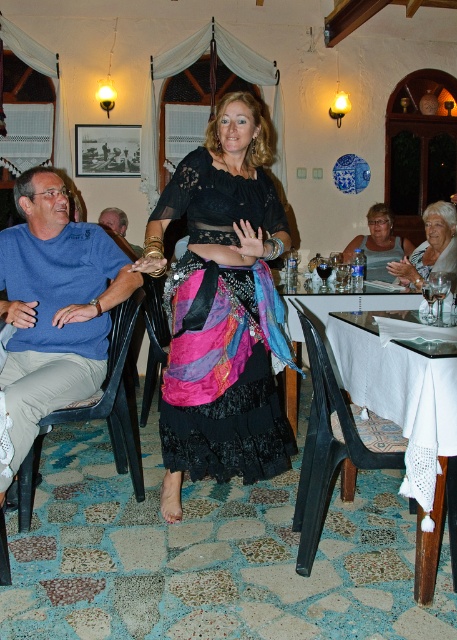
You are standing at the entrance of the restaurant and want to sit down. There is a black plastic chair at lower center. Can you walk directly to the chair without moving around any obstacles?

The black plastic chair at lower center is located at point (328, 449) in the image. Since there are no other objects mentioned in the scene that could block the path, you can walk directly to the chair without moving around any obstacles.

You are a dancer who just finished a performance and need to sit down. You see a black plastic chair at left. Can you reach it without moving more than 2 meters from your current position?

The distance between you and the black plastic chair at left is 2.12 meters, so you cannot reach it without moving more than 2 meters.